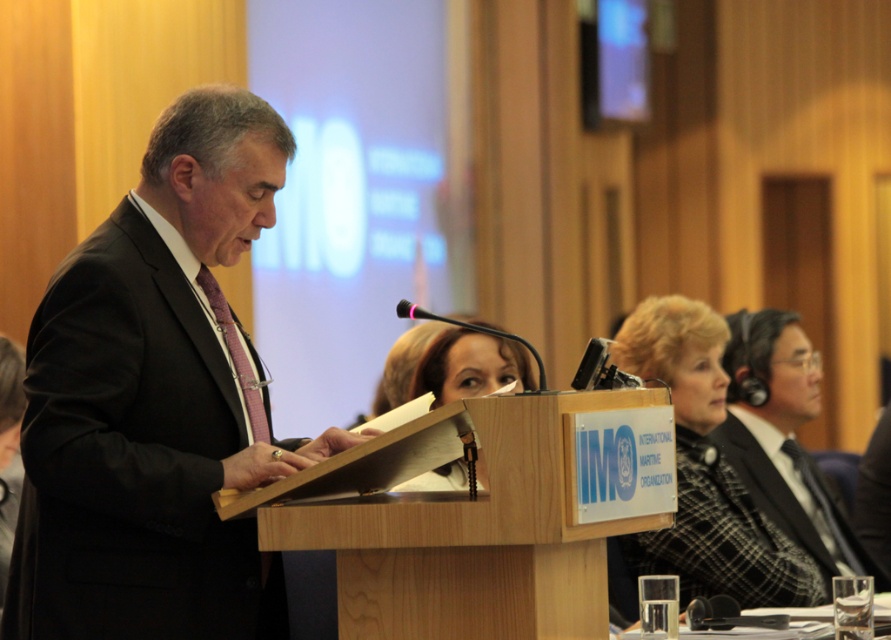
Who is shorter, plaid wool blazer at center or matte black headphones at center?

matte black headphones at center

Between plaid wool blazer at center and matte black headphones at center, which one has more height?

plaid wool blazer at center is taller.

Is point (668, 547) closer to camera compared to point (432, 332)?

Yes, point (668, 547) is closer to viewer.

The width and height of the screenshot is (891, 640). In order to click on plaid wool blazer at center in this screenshot , I will do `click(701, 476)`.

Can you confirm if black suit at left is shorter than matte black headphones at center?

No, black suit at left is not shorter than matte black headphones at center.

Measure the distance between black suit at left and camera.

They are 8.17 feet apart.

The width and height of the screenshot is (891, 640). In order to click on black suit at left in this screenshot , I will do `click(157, 401)`.

Find the location of `black suit at left`. black suit at left is located at coordinates (157, 401).

Looking at this image, can you confirm if black suit at left is taller than wooden podium at center?

Yes, black suit at left is taller than wooden podium at center.

Does point (211, 561) lie in front of point (495, 492)?

No, it is not.

Where is `black suit at left`? black suit at left is located at coordinates (157, 401).